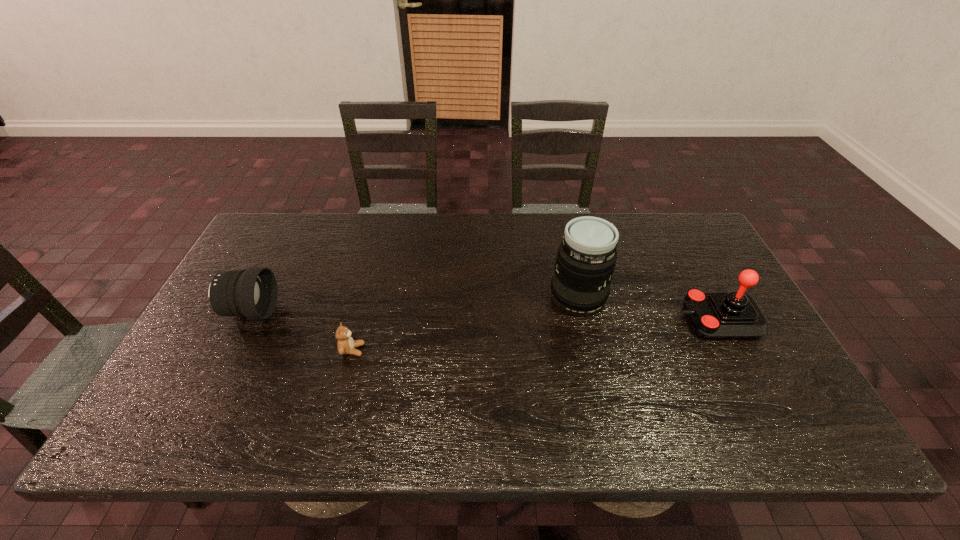
Find the location of `free space located 0.130m on the base of the second tallest object`. free space located 0.130m on the base of the second tallest object is located at coordinates (631, 320).

You are a GUI agent. You are given a task and a screenshot of the screen. Output one action in this format:
    pyautogui.click(x=<x>, y=<y>)
    Task: Click on the free space located 0.330m on the base of the second tallest object
    
    Given the screenshot: What is the action you would take?
    pyautogui.click(x=556, y=320)

This screenshot has height=540, width=960. I want to click on vacant space located 0.330m at the front element of the leftmost object, so click(x=396, y=312).

I want to click on vacant region located 0.200m on the front-facing side of the teddy bear, so click(x=444, y=350).

The height and width of the screenshot is (540, 960). Find the location of `object that is positioned at the left edge`. object that is positioned at the left edge is located at coordinates (252, 293).

Find the location of a particular element. object located at the right edge is located at coordinates (714, 315).

The height and width of the screenshot is (540, 960). Find the location of `vacant space at the far edge`. vacant space at the far edge is located at coordinates (497, 213).

Find the location of a particular element. This screenshot has height=540, width=960. vacant space at the near edge of the desktop is located at coordinates (381, 409).

In the image, there is a desktop. What are the coordinates of `vacant space at the right edge` in the screenshot? It's located at (686, 271).

Where is `free space at the far right corner`? free space at the far right corner is located at coordinates (666, 246).